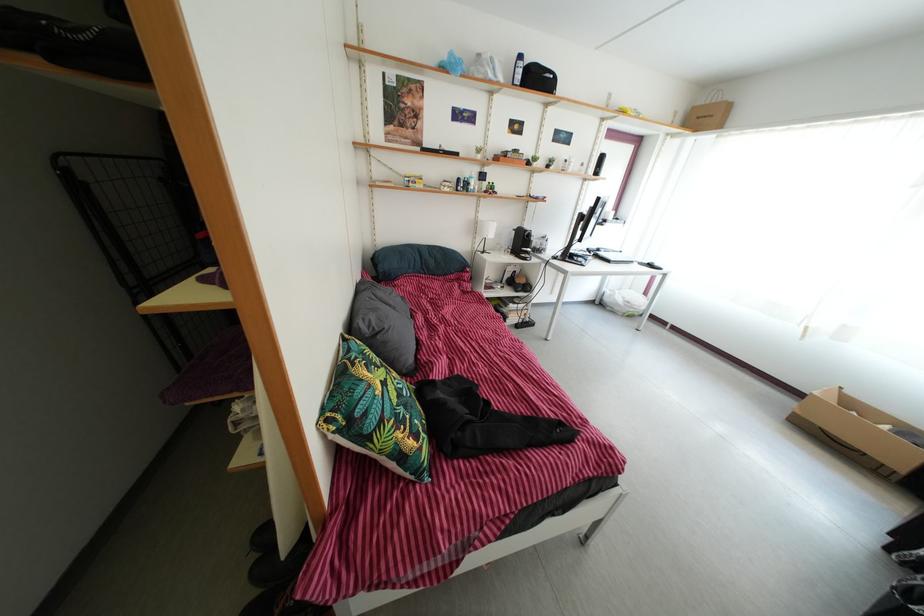
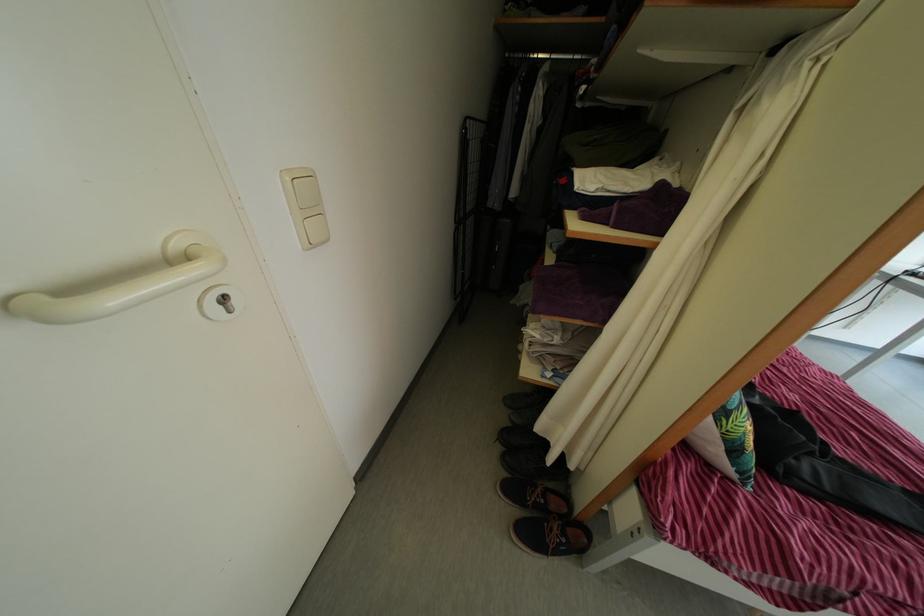
Where in the second image is the point corresponding to point 261,565 from the first image?

(505, 456)